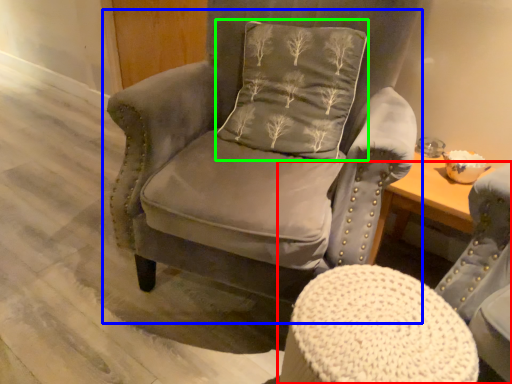
Question: Considering the real-world distances, which object is closest to chair (highlighted by a red box)? chair (highlighted by a blue box) or pillow (highlighted by a green box).

Choices:
 (A) chair
 (B) pillow

Answer: (A)